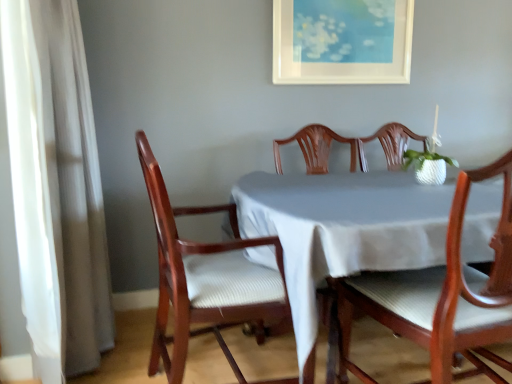
Question: Is white matte picture frame at upper center turned away from wooden chair at left, placed as the 2th chair when sorted from right to left?

Choices:
 (A) yes
 (B) no

Answer: (B)

Question: From the image's perspective, is white matte picture frame at upper center below wooden chair at left, placed as the 2th chair when sorted from right to left?

Choices:
 (A) no
 (B) yes

Answer: (A)

Question: Does white matte picture frame at upper center appear on the left side of wooden chair at left, the 1th chair viewed from the left?

Choices:
 (A) no
 (B) yes

Answer: (A)

Question: Would you say wooden chair at left, placed as the 2th chair when sorted from right to left, is part of white matte picture frame at upper center's contents?

Choices:
 (A) no
 (B) yes

Answer: (A)

Question: Does white matte picture frame at upper center turn towards wooden chair at left, the 1th chair viewed from the left?

Choices:
 (A) yes
 (B) no

Answer: (B)

Question: From a real-world perspective, is white matte picture frame at upper center physically above wooden chair at left, placed as the 2th chair when sorted from right to left?

Choices:
 (A) yes
 (B) no

Answer: (A)

Question: Considering the relative sizes of white sheer curtain at left and wooden chair at center, the 2th chair when ordered from left to right, in the image provided, is white sheer curtain at left taller than wooden chair at center, the 2th chair when ordered from left to right,?

Choices:
 (A) yes
 (B) no

Answer: (A)

Question: Is white sheer curtain at left directly adjacent to wooden chair at center, marked as the 1th chair in a right-to-left arrangement?

Choices:
 (A) no
 (B) yes

Answer: (A)

Question: Would you say white sheer curtain at left is a long distance from wooden chair at center, marked as the 1th chair in a right-to-left arrangement?

Choices:
 (A) yes
 (B) no

Answer: (A)

Question: Could you tell me if white sheer curtain at left is facing wooden chair at center, marked as the 1th chair in a right-to-left arrangement?

Choices:
 (A) no
 (B) yes

Answer: (A)

Question: Does white sheer curtain at left have a greater width compared to wooden chair at center, marked as the 1th chair in a right-to-left arrangement?

Choices:
 (A) no
 (B) yes

Answer: (A)

Question: Is white sheer curtain at left looking in the opposite direction of wooden chair at center, marked as the 1th chair in a right-to-left arrangement?

Choices:
 (A) yes
 (B) no

Answer: (B)

Question: Considering the relative sizes of white sheer curtain at left and white matte picture frame at upper center in the image provided, is white sheer curtain at left smaller than white matte picture frame at upper center?

Choices:
 (A) no
 (B) yes

Answer: (A)